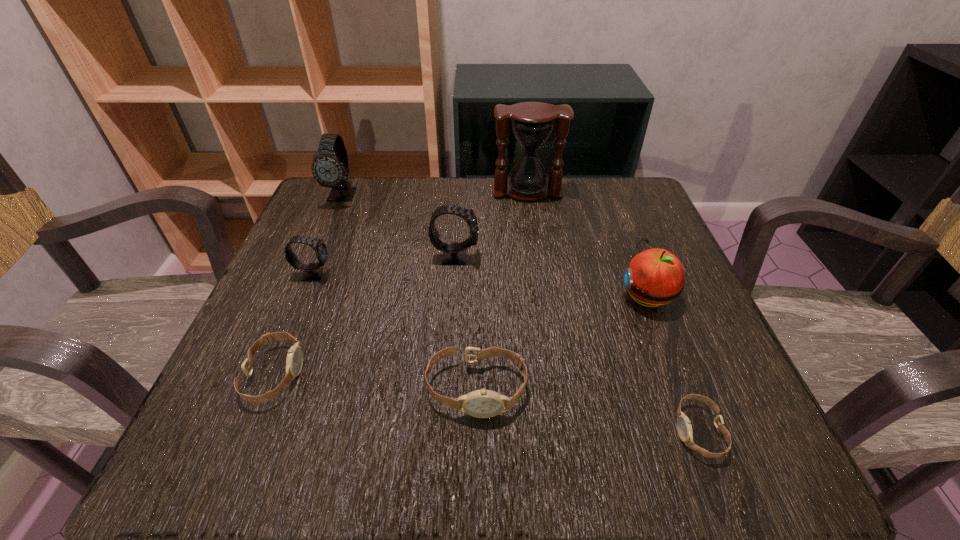
Where is `free space between the third tallest watch and the second biggest beige watch`? free space between the third tallest watch and the second biggest beige watch is located at coordinates (294, 325).

This screenshot has height=540, width=960. Find the location of `unoccupied area between the third farthest watch and the second tallest object`. unoccupied area between the third farthest watch and the second tallest object is located at coordinates (328, 234).

Identify the location of vacant region between the tallest object and the fifth shortest watch. This screenshot has width=960, height=540. (492, 224).

At what (x,y) coordinates should I click in order to perform the action: click on unoccupied area between the shortest watch and the brown hourglass. Please return your answer as a coordinate pair (x, y). This screenshot has width=960, height=540. Looking at the image, I should click on (612, 312).

I want to click on free space between the apple and the brown hourglass, so click(x=587, y=244).

Where is `object that is the fifth closest to the sixth nearest object`? object that is the fifth closest to the sixth nearest object is located at coordinates (654, 277).

Where is `the closest object relative to the fourth nearest watch`? This screenshot has height=540, width=960. the closest object relative to the fourth nearest watch is located at coordinates (294, 361).

Select which watch appears as the closest to the smallest gray watch. Please provide its 2D coordinates. Your answer should be formatted as a tuple, i.e. [(x, y)], where the tuple contains the x and y coordinates of a point satisfying the conditions above.

[(294, 361)]

Identify which watch is the fifth closest to the fourth shortest watch. Please provide its 2D coordinates. Your answer should be formatted as a tuple, i.e. [(x, y)], where the tuple contains the x and y coordinates of a point satisfying the conditions above.

[(684, 427)]

The image size is (960, 540). Find the location of `the third closest gray watch relative to the apple`. the third closest gray watch relative to the apple is located at coordinates (330, 167).